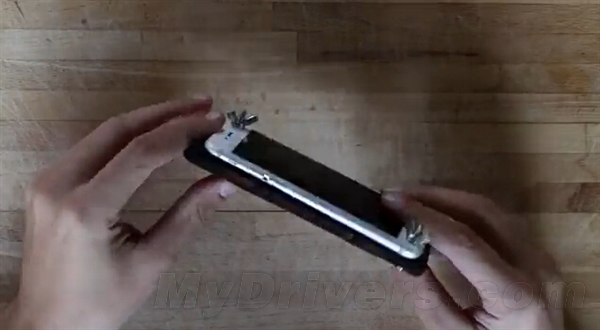
At what (x,y) coordinates should I click in order to perform the action: click on phone screen. Please return your answer as a coordinate pair (x, y). Looking at the image, I should click on (322, 185).